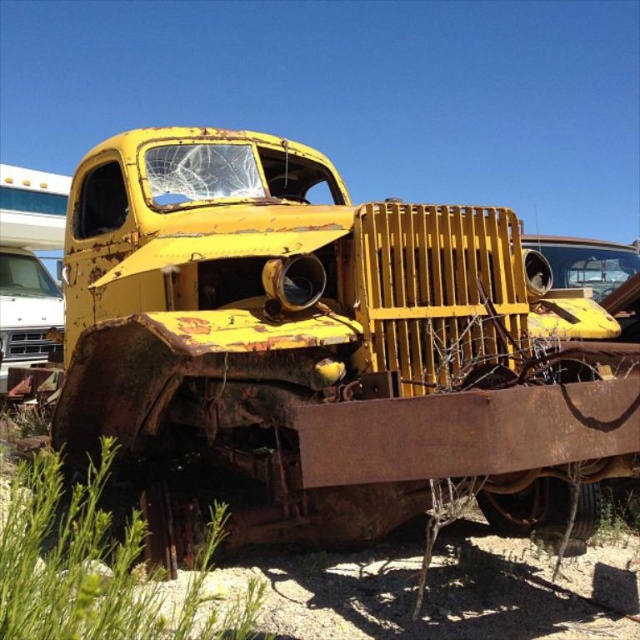
Question: Is rusty yellow truck at center to the right of green leafy grass at lower left from the viewer's perspective?

Choices:
 (A) yes
 (B) no

Answer: (A)

Question: Does rusty yellow truck at center appear under rusty metal truck at center?

Choices:
 (A) no
 (B) yes

Answer: (B)

Question: Which is nearer to the rusty metal truck at center?

Choices:
 (A) rusty yellow truck at center
 (B) green leafy grass at lower left

Answer: (A)

Question: Which of the following is the farthest from the observer?

Choices:
 (A) [193, 248]
 (B) [554, 260]

Answer: (B)

Question: Is green leafy grass at lower left above rusty metal truck at center?

Choices:
 (A) yes
 (B) no

Answer: (B)

Question: Among these points, which one is nearest to the camera?

Choices:
 (A) (68, 508)
 (B) (433, 365)
 (C) (560, 276)

Answer: (B)